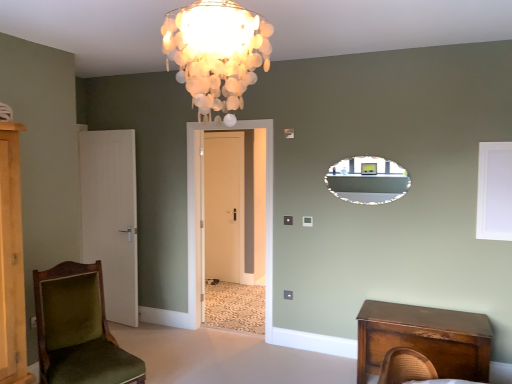
Question: Should I look upward or downward to see velvet green chair at lower left?

Choices:
 (A) up
 (B) down

Answer: (B)

Question: From a real-world perspective, is beige matte door at center, the 1th door positioned from the back, positioned over ivory shell chandelier at upper center based on gravity?

Choices:
 (A) yes
 (B) no

Answer: (B)

Question: Is beige matte door at center, the 2th door viewed from the right, positioned beyond the bounds of ivory shell chandelier at upper center?

Choices:
 (A) yes
 (B) no

Answer: (A)

Question: Considering the relative sizes of beige matte door at center, positioned as the third door in front-to-back order, and ivory shell chandelier at upper center in the image provided, is beige matte door at center, positioned as the third door in front-to-back order, bigger than ivory shell chandelier at upper center?

Choices:
 (A) no
 (B) yes

Answer: (A)

Question: From a real-world perspective, does beige matte door at center, the second door when ordered from left to right, sit lower than ivory shell chandelier at upper center?

Choices:
 (A) no
 (B) yes

Answer: (B)

Question: Is the depth of beige matte door at center, positioned as the third door in front-to-back order, greater than that of ivory shell chandelier at upper center?

Choices:
 (A) yes
 (B) no

Answer: (A)

Question: From the image's perspective, is beige matte door at center, positioned as the third door in front-to-back order, over ivory shell chandelier at upper center?

Choices:
 (A) no
 (B) yes

Answer: (A)

Question: Does velvet green chair at lower left have a lesser width compared to matte black mirror at upper center?

Choices:
 (A) yes
 (B) no

Answer: (B)

Question: From the image's perspective, is velvet green chair at lower left above matte black mirror at upper center?

Choices:
 (A) yes
 (B) no

Answer: (B)

Question: Is velvet green chair at lower left taller than matte black mirror at upper center?

Choices:
 (A) yes
 (B) no

Answer: (A)

Question: Is velvet green chair at lower left placed right next to matte black mirror at upper center?

Choices:
 (A) no
 (B) yes

Answer: (A)

Question: From a real-world perspective, is velvet green chair at lower left below matte black mirror at upper center?

Choices:
 (A) no
 (B) yes

Answer: (B)

Question: Is velvet green chair at lower left at the right side of matte black mirror at upper center?

Choices:
 (A) no
 (B) yes

Answer: (A)

Question: Can you confirm if white matte window screen at upper right is positioned to the right of matte black mirror at upper center?

Choices:
 (A) no
 (B) yes

Answer: (B)